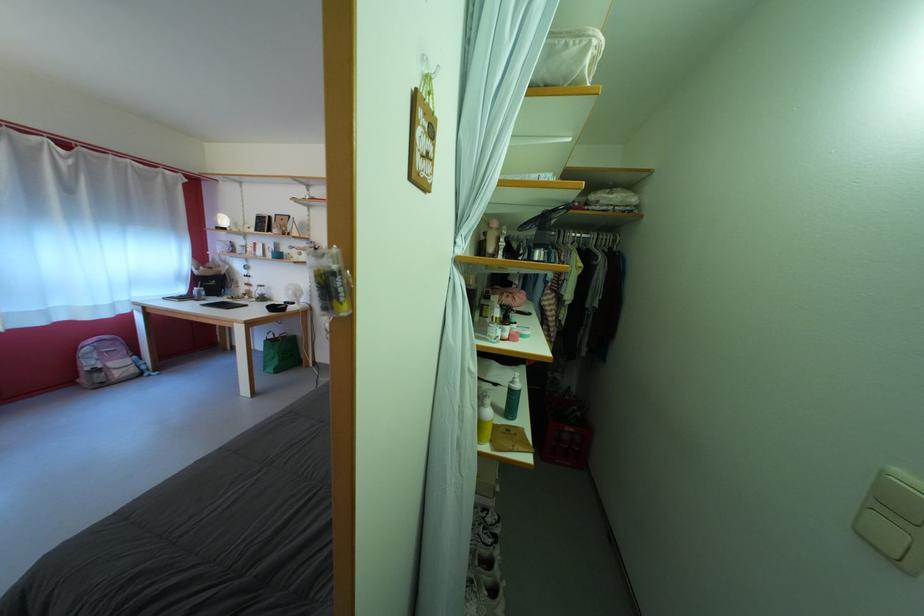
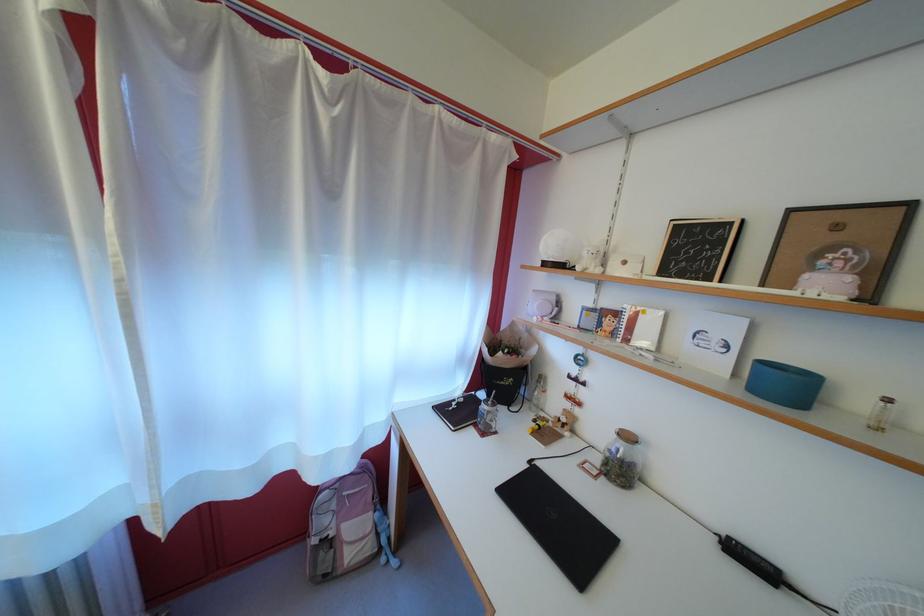
Find the pixel in the second image that matches (x=77, y=196) in the first image.

(335, 193)